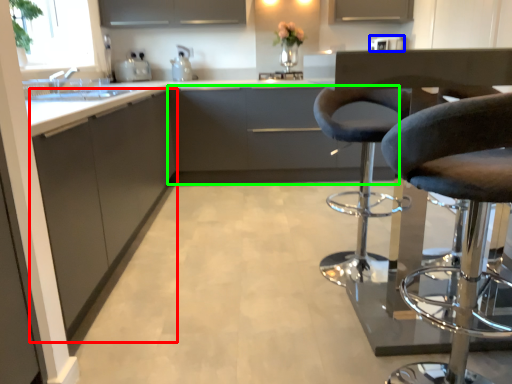
Question: Estimate the real-world distances between objects in this image. Which object is closer to cabinetry (highlighted by a red box), appliance (highlighted by a blue box) or cabinetry (highlighted by a green box)?

Choices:
 (A) appliance
 (B) cabinetry

Answer: (B)